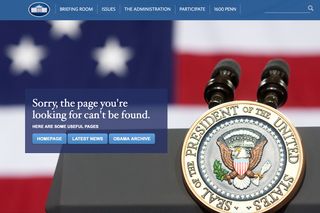
Find the location of `breifing room tab`. breifing room tab is located at coordinates (83, 9).